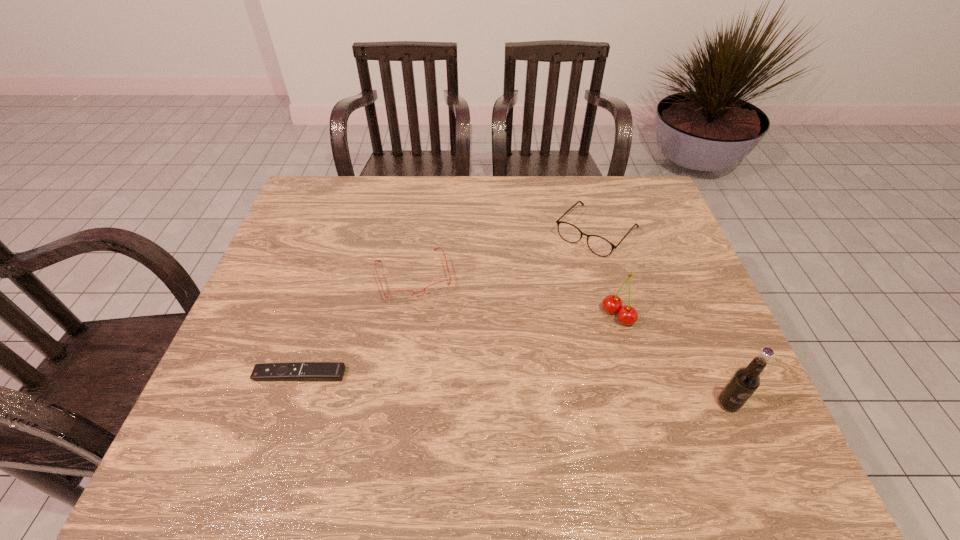
Identify the location of free space located on the front-facing side of the right spectacles. This screenshot has height=540, width=960. (533, 305).

The image size is (960, 540). I want to click on free spot located 0.290m on the front-facing side of the right spectacles, so click(520, 320).

Find the location of `free space located 0.270m on the front-facing side of the right spectacles`. free space located 0.270m on the front-facing side of the right spectacles is located at coordinates (524, 314).

Find the location of `vacant space located 0.190m with the stems of the fourth shortest object pointing upwards`. vacant space located 0.190m with the stems of the fourth shortest object pointing upwards is located at coordinates (556, 367).

Identify the location of free space located with the stems of the fourth shortest object pointing upwards. (590, 339).

Locate an element on the screen. This screenshot has width=960, height=540. vacant space situated 0.370m with the stems of the fourth shortest object pointing upwards is located at coordinates (498, 416).

Identify the location of vacant space located on the lenses of the left spectacles. The width and height of the screenshot is (960, 540). (445, 382).

Find the location of a particular element. This screenshot has height=540, width=960. free space located 0.300m on the lenses of the left spectacles is located at coordinates (452, 405).

Locate an element on the screen. vacant space located on the lenses of the left spectacles is located at coordinates (433, 340).

Locate an element on the screen. The width and height of the screenshot is (960, 540). object positioned at the far edge is located at coordinates (600, 246).